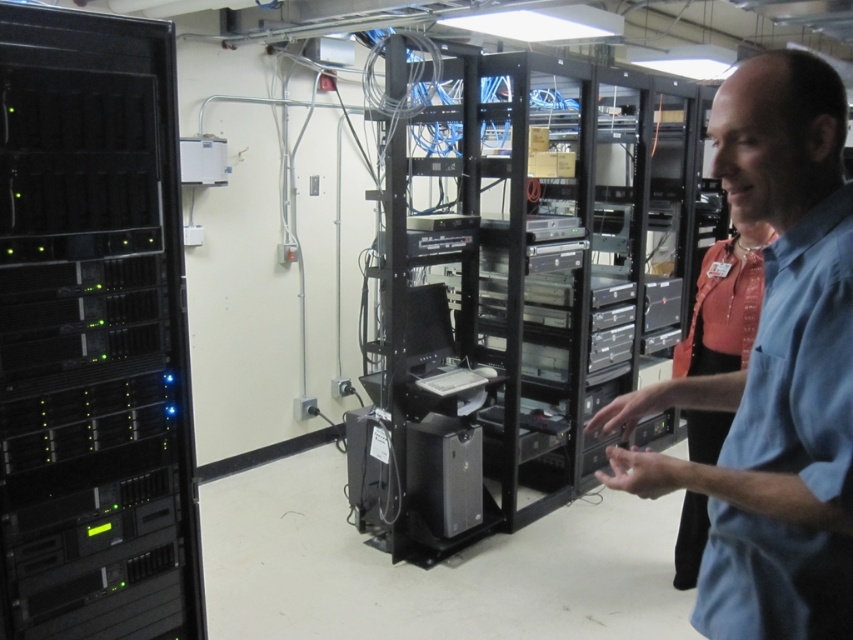
Question: Observing the image, what is the correct spatial positioning of black metal server rack at center in reference to blue shirt at center?

Choices:
 (A) above
 (B) below

Answer: (A)

Question: Which point is closer to the camera?

Choices:
 (A) black metal server rack at center
 (B) black metallic server at left
 (C) blue shirt at center

Answer: (C)

Question: Which of the following is the closest to the observer?

Choices:
 (A) pos(16,499)
 (B) pos(445,454)

Answer: (A)

Question: Is black metallic server at left wider than blue shirt at center?

Choices:
 (A) no
 (B) yes

Answer: (B)

Question: Which point is closer to the camera?

Choices:
 (A) black metal server rack at center
 (B) black metallic server at left
 (C) blue shirt at center

Answer: (C)

Question: Is black metal server rack at center positioned in front of black metallic server at left?

Choices:
 (A) yes
 (B) no

Answer: (B)